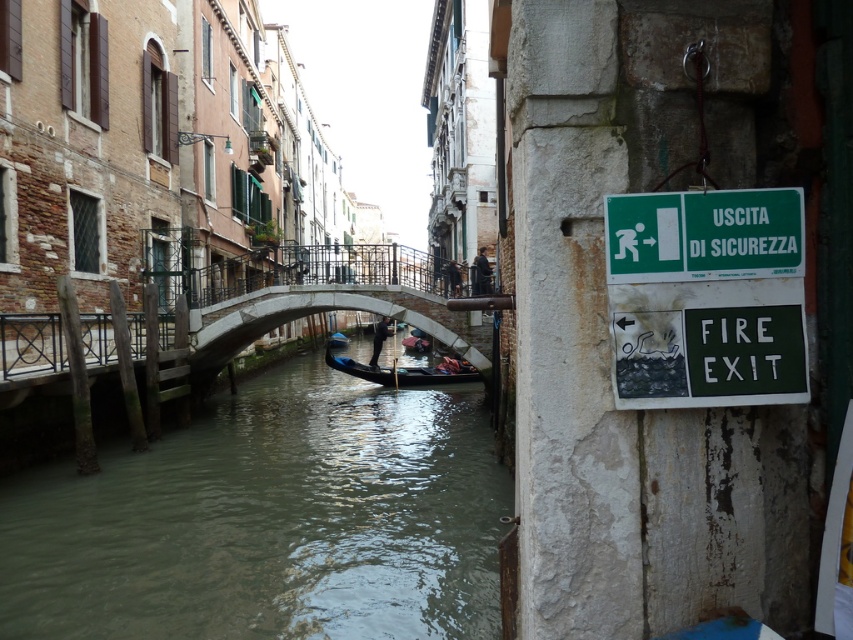
Question: Does green plastic sign at upper right appear on the left side of wooden gondola at center?

Choices:
 (A) no
 (B) yes

Answer: (A)

Question: Among these objects, which one is nearest to the camera?

Choices:
 (A) blue glossy boat at center
 (B) green plastic sign at upper right
 (C) greenish water at center

Answer: (B)

Question: Is green plastic sign at upper right wider than blue glossy boat at center?

Choices:
 (A) yes
 (B) no

Answer: (B)

Question: Which point is farther from the camera taking this photo?

Choices:
 (A) (360, 372)
 (B) (373, 358)

Answer: (B)

Question: Does green plastic sign at upper right have a larger size compared to black leather gondolier at center?

Choices:
 (A) no
 (B) yes

Answer: (A)

Question: Which point is farther from the camera taking this photo?

Choices:
 (A) (462, 374)
 (B) (181, 465)
 (C) (378, 340)

Answer: (C)